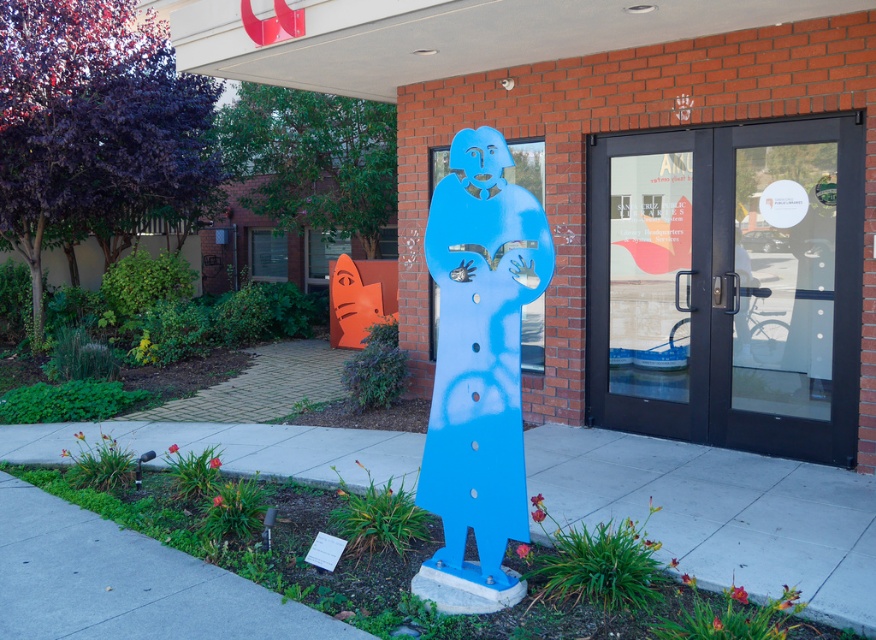
Question: Is black glass doors at center positioned behind blue matte sculpture at center?

Choices:
 (A) yes
 (B) no

Answer: (A)

Question: Which of the following is the farthest from the observer?

Choices:
 (A) black glass doors at center
 (B) blue matte sculpture at center

Answer: (A)

Question: Does black glass doors at center appear under blue matte sculpture at center?

Choices:
 (A) yes
 (B) no

Answer: (B)

Question: Can you confirm if black glass doors at center is positioned to the left of blue matte sculpture at center?

Choices:
 (A) yes
 (B) no

Answer: (B)